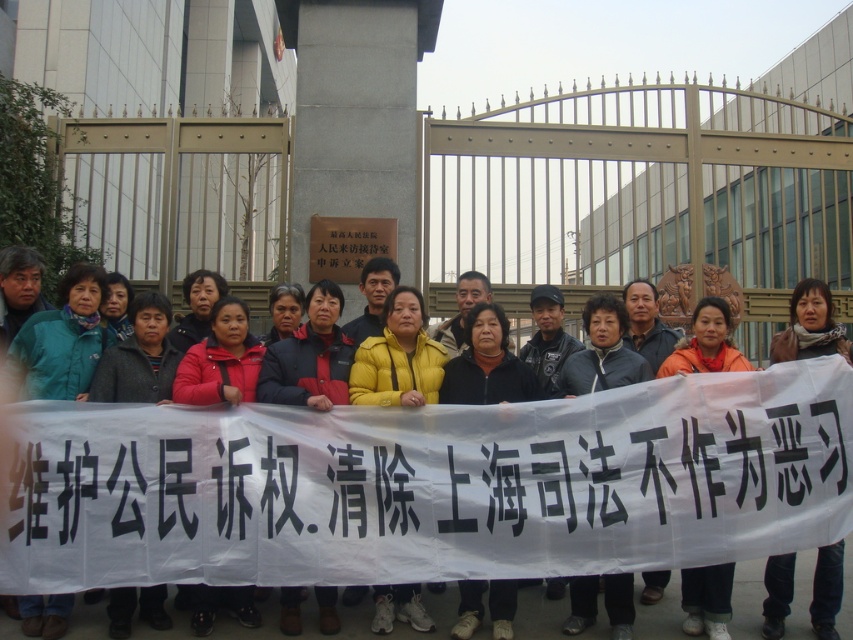
From the picture: You are a photographer trying to capture a clear photo of the yellow fabric jacket at center and the black paper banner at center. Based on their sizes, which object should you focus on first to ensure it appears larger in your photo?

The black paper banner at center is taller than the yellow fabric jacket at center, so focusing on the black paper banner at center first will ensure it appears larger in the photo.

You are a photographer standing at the camera position. You want to take a closeup photo of the yellow fabric jacket at center. The camera has a maximum zoom range of 10 meters. Can you capture the jacket in focus without moving the camera or the jacket?

The yellow fabric jacket at center is 8.45 meters away from the camera. Since the camera can zoom up to 10 meters, it is within range. Therefore, you can capture the jacket in focus without moving either.

You are a photographer standing at the back of the group. You want to take a photo of the yellow fabric jacket at center. Where should you aim your camera to capture the jacket in the frame?

You should aim your camera at the point with coordinates 0.759 on the horizontal axis and 0.505 on the vertical axis to capture the yellow fabric jacket at center.